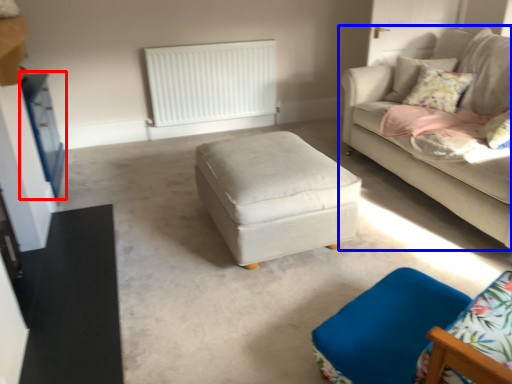
Question: Which point is closer to the camera, dresser (highlighted by a red box) or studio couch (highlighted by a blue box)?

Choices:
 (A) dresser
 (B) studio couch

Answer: (B)